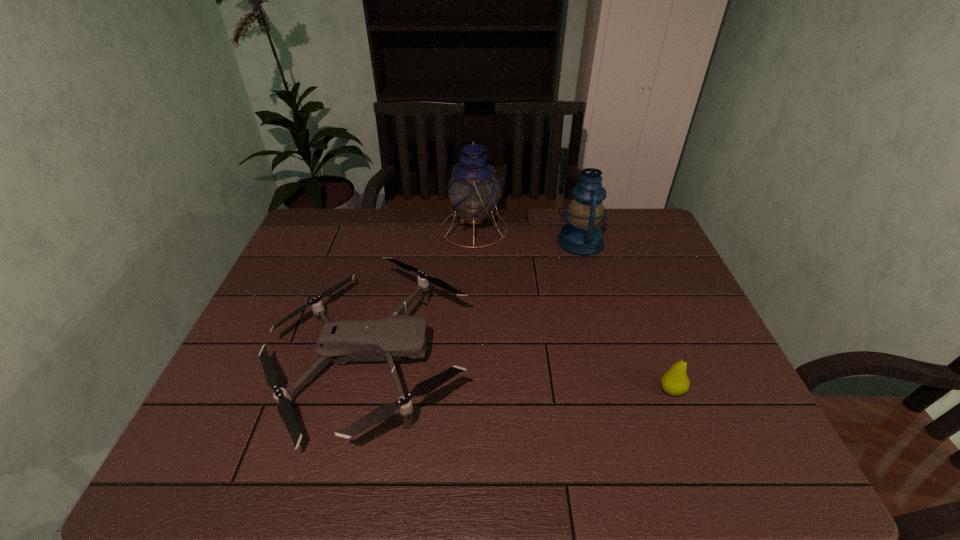
Find the location of a particular element. The image size is (960, 540). vacant area that lies between the tallest object and the pear is located at coordinates (573, 309).

I want to click on vacant area that lies between the third object from left to right and the taller lantern, so click(527, 235).

Locate an element on the screen. The height and width of the screenshot is (540, 960). free point between the third object from left to right and the drone is located at coordinates (476, 300).

Find the location of a particular element. empty space that is in between the tallest object and the third shortest object is located at coordinates (527, 235).

The height and width of the screenshot is (540, 960). Find the location of `blank region between the third shortest object and the left lantern`. blank region between the third shortest object and the left lantern is located at coordinates point(527,235).

Locate an element on the screen. vacant space in between the pear and the taller lantern is located at coordinates (573, 309).

This screenshot has height=540, width=960. What are the coordinates of `free space between the left lantern and the rightmost object` in the screenshot? It's located at (573, 309).

Locate an element on the screen. free space between the second object from right to left and the pear is located at coordinates (626, 316).

Identify the location of free space between the drone and the second object from right to left. pyautogui.click(x=476, y=300).

Locate an element on the screen. The width and height of the screenshot is (960, 540). free area in between the taller lantern and the third object from left to right is located at coordinates (527, 235).